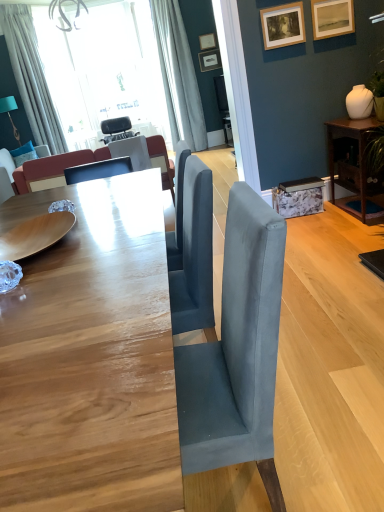
Question: From the image's perspective, is matte black picture frame at upper center, which is the fourth picture frame from front to back, on top of white fabric curtain at upper center, which ranks as the 2th curtain in left-to-right order?

Choices:
 (A) yes
 (B) no

Answer: (A)

Question: Is matte black picture frame at upper center, which is counted as the 1th picture frame, starting from the back, far from white fabric curtain at upper center, which ranks as the 2th curtain in left-to-right order?

Choices:
 (A) no
 (B) yes

Answer: (A)

Question: Does matte black picture frame at upper center, which is the fourth picture frame from front to back, turn towards white fabric curtain at upper center, the first curtain from the right?

Choices:
 (A) no
 (B) yes

Answer: (A)

Question: Considering the relative positions of matte black picture frame at upper center, which ranks as the 2th picture frame in top-to-bottom order, and white fabric curtain at upper center, the first curtain from the right, in the image provided, is matte black picture frame at upper center, which ranks as the 2th picture frame in top-to-bottom order, to the right of white fabric curtain at upper center, the first curtain from the right, from the viewer's perspective?

Choices:
 (A) no
 (B) yes

Answer: (B)

Question: Is matte black picture frame at upper center, the 3th picture frame in the bottom-to-top sequence, smaller than white fabric curtain at upper center, which ranks as the 2th curtain in left-to-right order?

Choices:
 (A) yes
 (B) no

Answer: (A)

Question: In terms of size, does velvet fabric couch at left, marked as the 2th couch in a right-to-left arrangement, appear bigger or smaller than matte black picture frame at upper center, which is counted as the 1th picture frame, starting from the back?

Choices:
 (A) big
 (B) small

Answer: (A)

Question: Is velvet fabric couch at left, which is the 1th couch from left to right, in front of or behind matte black picture frame at upper center, which is counted as the 1th picture frame, starting from the back, in the image?

Choices:
 (A) behind
 (B) front

Answer: (B)

Question: Does point (9, 159) appear closer or farther from the camera than point (203, 64)?

Choices:
 (A) farther
 (B) closer

Answer: (B)

Question: From a real-world perspective, is velvet fabric couch at left, the second couch positioned from the front, above or below matte black picture frame at upper center, which ranks as the 2th picture frame in top-to-bottom order?

Choices:
 (A) above
 (B) below

Answer: (B)

Question: Based on their positions, is matte black chair at center, arranged as the 1th chair when viewed from the right, located to the left or right of white fabric curtain at upper left, positioned as the 2th curtain in right-to-left order?

Choices:
 (A) right
 (B) left

Answer: (A)

Question: Choose the correct answer: Is matte black chair at center, which ranks as the second chair in left-to-right order, inside white fabric curtain at upper left, positioned as the 2th curtain in right-to-left order, or outside it?

Choices:
 (A) inside
 (B) outside

Answer: (B)

Question: From the image's perspective, is matte black chair at center, which ranks as the second chair in back-to-front order, located above or below white fabric curtain at upper left, arranged as the 1th curtain when viewed from the left?

Choices:
 (A) below
 (B) above

Answer: (A)

Question: Based on their sizes in the image, would you say matte black chair at center, positioned as the first chair in bottom-to-top order, is bigger or smaller than white fabric curtain at upper left, positioned as the 2th curtain in right-to-left order?

Choices:
 (A) small
 (B) big

Answer: (A)

Question: From the image's perspective, relative to white fabric curtain at upper center, which ranks as the 2th curtain in left-to-right order, is matte white picture frame at upper center, acting as the third picture frame starting from the front, above or below?

Choices:
 (A) above
 (B) below

Answer: (A)

Question: Based on their positions, is matte white picture frame at upper center, acting as the third picture frame starting from the front, located to the left or right of white fabric curtain at upper center, the first curtain from the right?

Choices:
 (A) left
 (B) right

Answer: (B)